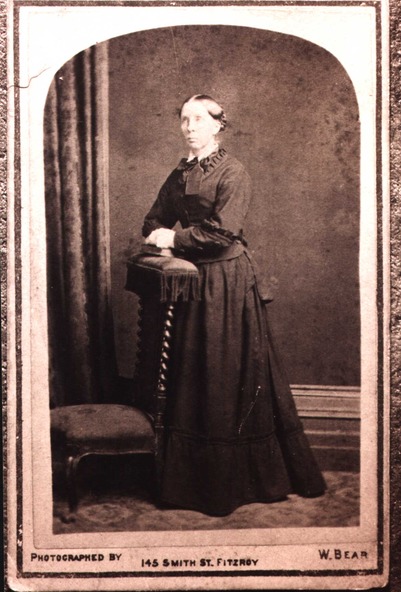
Identify the location of rug. The width and height of the screenshot is (401, 592). (317, 519).